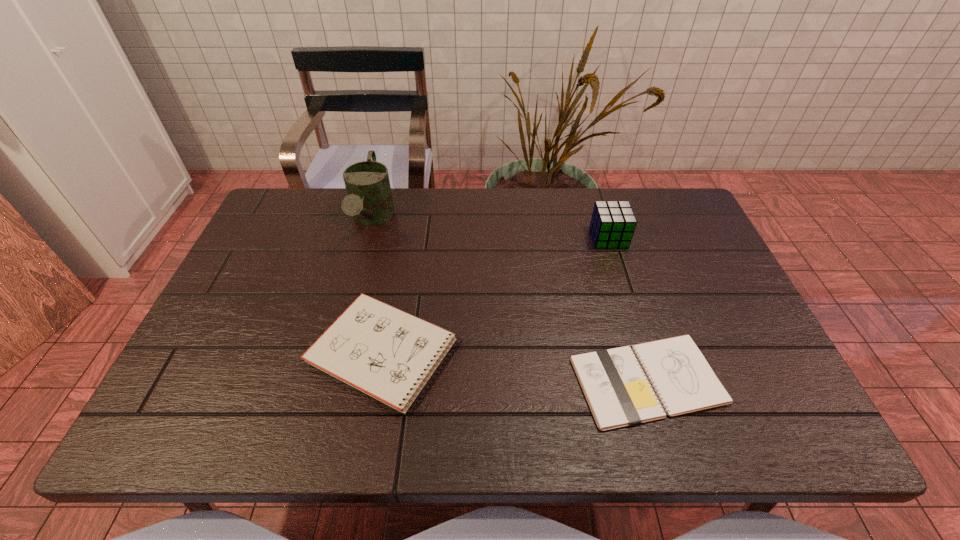
What are the coordinates of `free point between the cube and the tallest object` in the screenshot? It's located at (491, 229).

Where is `free space between the watering can and the taller notepad`? The image size is (960, 540). free space between the watering can and the taller notepad is located at coordinates (378, 286).

The image size is (960, 540). I want to click on free spot between the shortest object and the third tallest object, so click(516, 366).

Find the location of a particular element. The height and width of the screenshot is (540, 960). vacant point located between the taller notepad and the watering can is located at coordinates (378, 286).

You are a GUI agent. You are given a task and a screenshot of the screen. Output one action in this format:
    pyautogui.click(x=<x>, y=<y>)
    Task: Click on the empty space that is in between the tallest object and the cube
    The width and height of the screenshot is (960, 540).
    Given the screenshot: What is the action you would take?
    pyautogui.click(x=491, y=229)

Locate an element on the screen. The width and height of the screenshot is (960, 540). empty location between the third shortest object and the taller notepad is located at coordinates (496, 295).

In order to click on vacant point located between the shortest object and the watering can in this screenshot , I will do `click(510, 300)`.

Find the location of a particular element. Image resolution: width=960 pixels, height=540 pixels. unoccupied position between the taller notepad and the shorter notepad is located at coordinates (516, 366).

The image size is (960, 540). I want to click on vacant space that's between the third tallest object and the tallest object, so click(378, 286).

Identify the location of object that is the second closest to the right notepad. (612, 225).